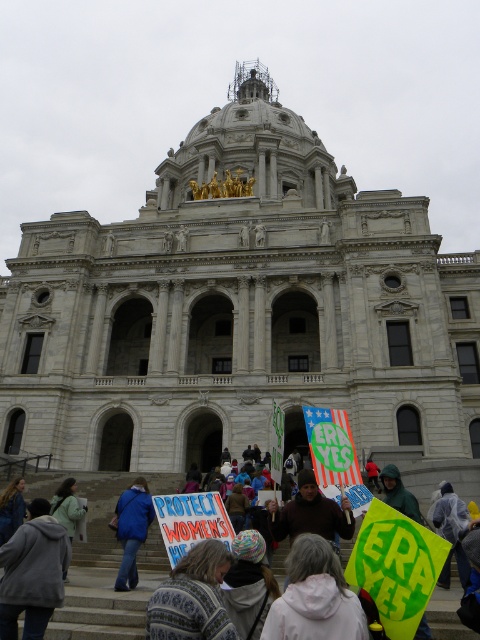
Based on the photo, you are a photographer trying to capture a shot of both the white fleece jacket at lower center and the knitted sweater at lower center in the same frame. Given their positions, which one will appear larger in your photo?

The white fleece jacket at lower center will appear larger in the photo because it is taller than the knitted sweater at lower center.

You are a photographer standing at the base of the steps leading to the grand neoclassical building. You want to take a photo of the white fleece jacket at lower center and ensure that the central dome with scaffolding is also visible in the frame. Given that the distance between them is 19.44 meters, will you be able to capture both in a single shot without moving your position?

The white fleece jacket at lower center and the central dome with scaffolding are 19.44 meters apart. Depending on the camera lens used, a wide angle lens would likely allow both subjects to be captured in a single frame from your current position.

You are standing at the base of the grand neoclassical building and see two points marked in the image. One is at point (146, 609) and the other at point (64, 506). Which of these two points is closer to you?

Point (146, 609) is in front of point (64, 506), so it is closer to you.